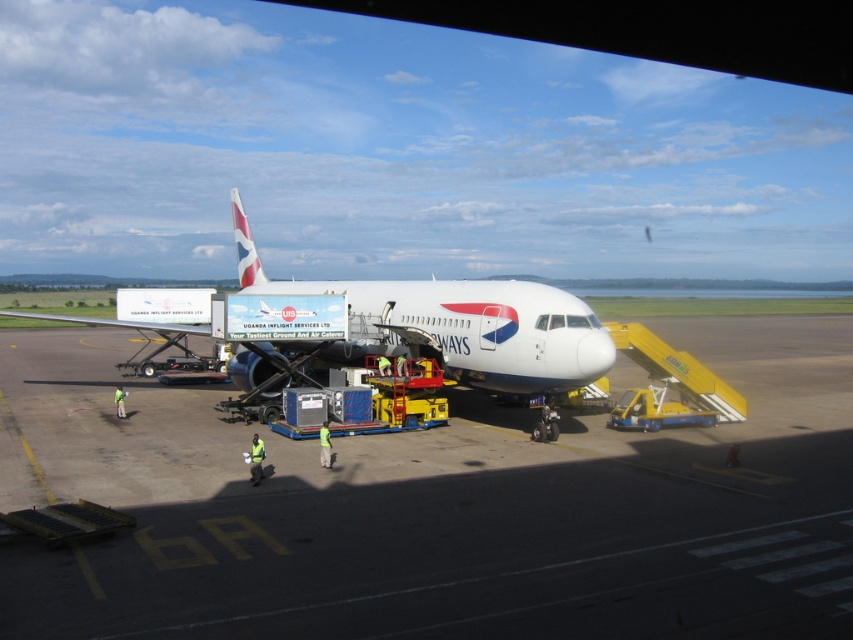
Question: Which object appears farthest from the camera in this image?

Choices:
 (A) smooth concrete tarmac at center
 (B) white glossy airplane at center

Answer: (B)

Question: Which point is closer to the camera?

Choices:
 (A) (463, 342)
 (B) (753, 337)

Answer: (A)

Question: Can you confirm if smooth concrete tarmac at center is positioned below white glossy airplane at center?

Choices:
 (A) yes
 (B) no

Answer: (A)

Question: Among these objects, which one is nearest to the camera?

Choices:
 (A) white glossy airplane at center
 (B) smooth concrete tarmac at center

Answer: (B)

Question: Is smooth concrete tarmac at center bigger than white glossy airplane at center?

Choices:
 (A) no
 (B) yes

Answer: (A)

Question: Can you confirm if smooth concrete tarmac at center is bigger than white glossy airplane at center?

Choices:
 (A) yes
 (B) no

Answer: (B)